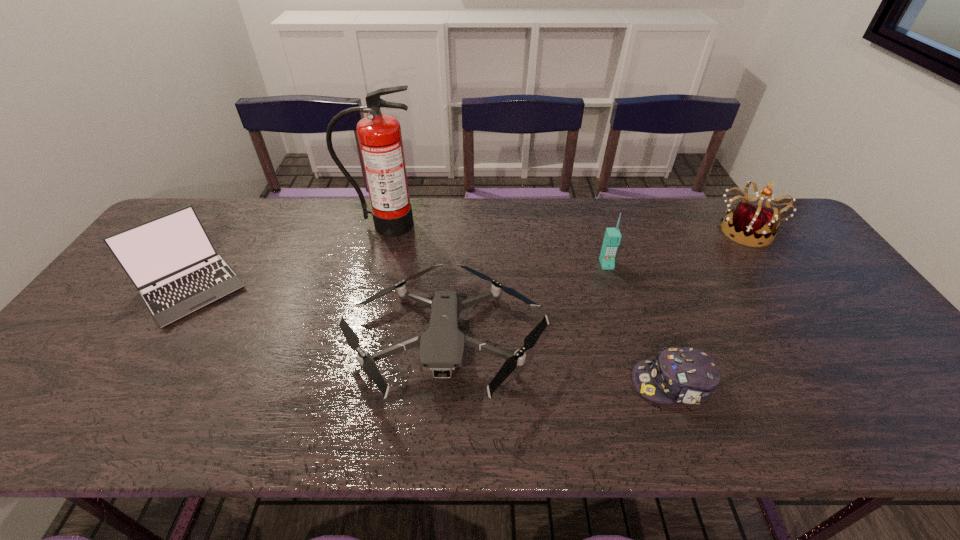
The height and width of the screenshot is (540, 960). I want to click on the tallest object, so click(x=380, y=139).

Find the location of a particular element. The image size is (960, 540). the rightmost object is located at coordinates (749, 225).

You are a GUI agent. You are given a task and a screenshot of the screen. Output one action in this format:
    pyautogui.click(x=<x>, y=<y>)
    Task: Click on the cellular telephone
    The image size is (960, 540).
    Given the screenshot: What is the action you would take?
    pyautogui.click(x=612, y=238)

You are a GUI agent. You are given a task and a screenshot of the screen. Output one action in this format:
    pyautogui.click(x=<x>, y=<y>)
    Task: Click on the leftmost object
    The height and width of the screenshot is (540, 960).
    Given the screenshot: What is the action you would take?
    pyautogui.click(x=170, y=251)

You are a GUI agent. You are given a task and a screenshot of the screen. Output one action in this format:
    pyautogui.click(x=<x>, y=<y>)
    Task: Click on the fifth tallest object
    This screenshot has height=540, width=960.
    Given the screenshot: What is the action you would take?
    pyautogui.click(x=442, y=346)

Where is `headwear`? headwear is located at coordinates (687, 375).

Identify the location of vacant space situated 0.340m on the front-facing side of the tallest object. This screenshot has height=540, width=960. (360, 320).

Where is `vacant space located on the front-facing side of the tiara`? This screenshot has width=960, height=540. vacant space located on the front-facing side of the tiara is located at coordinates (790, 294).

Find the location of a particular element. vacant position located 0.400m on the keypad of the cellular telephone is located at coordinates (646, 393).

Identify the location of vacant region located at the front screen of the leftmost object. (143, 360).